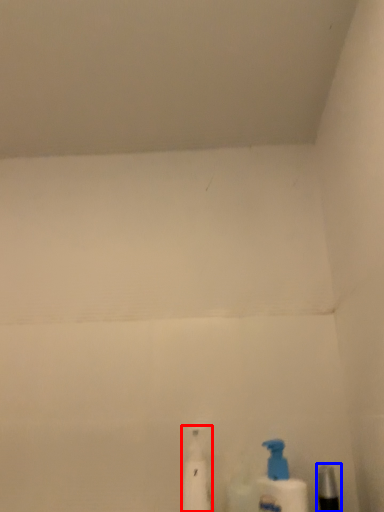
Question: Which object appears closest to the camera in this image, cleaning product (highlighted by a red box) or toiletry (highlighted by a blue box)?

Choices:
 (A) cleaning product
 (B) toiletry

Answer: (B)